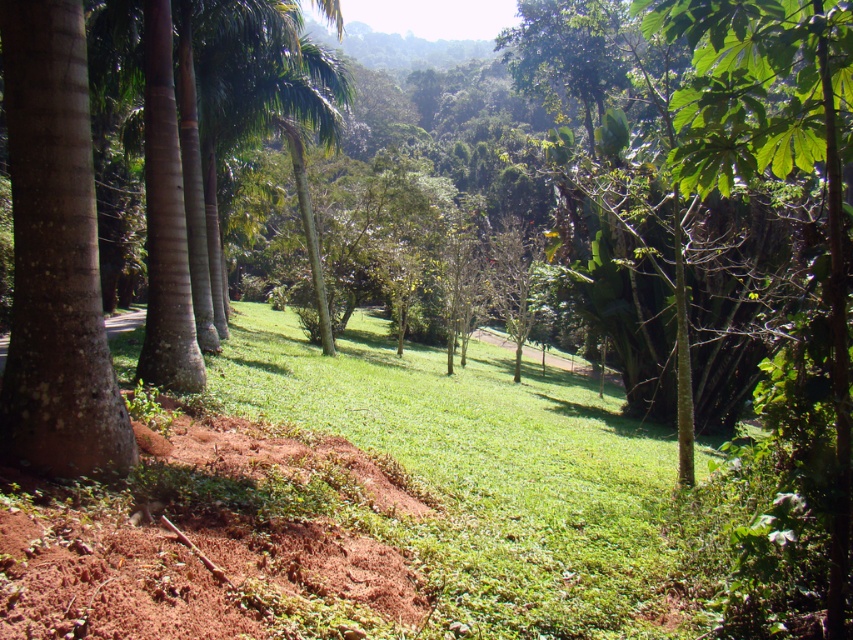
Question: Can you confirm if green grassy at center is positioned to the right of smooth brown palm tree at left?

Choices:
 (A) yes
 (B) no

Answer: (A)

Question: Can you confirm if green grassy at center is thinner than smooth brown palm tree at left?

Choices:
 (A) yes
 (B) no

Answer: (B)

Question: Which point appears closest to the camera in this image?

Choices:
 (A) (213, 262)
 (B) (666, 624)

Answer: (B)

Question: Which object appears farthest from the camera in this image?

Choices:
 (A) smooth brown palm tree at left
 (B) green grassy at center

Answer: (A)

Question: From the image, what is the correct spatial relationship of green grassy at center in relation to smooth brown palm tree at left?

Choices:
 (A) above
 (B) below

Answer: (B)

Question: Which point appears farthest from the camera in this image?

Choices:
 (A) (117, 22)
 (B) (614, 604)

Answer: (A)